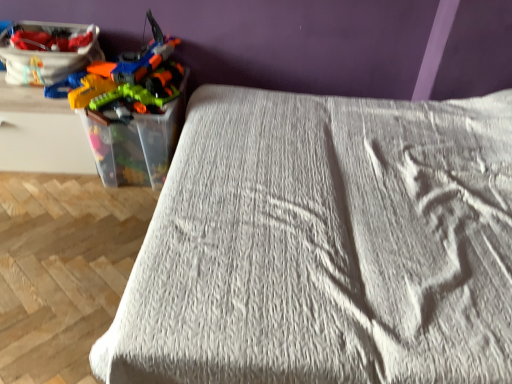
Question: Does white textured bed at center turn towards translucent plastic toy guns at left?

Choices:
 (A) no
 (B) yes

Answer: (B)

Question: From the image's perspective, is white textured bed at center under translucent plastic toy guns at left?

Choices:
 (A) yes
 (B) no

Answer: (A)

Question: Does white textured bed at center have a greater width compared to translucent plastic toy guns at left?

Choices:
 (A) no
 (B) yes

Answer: (B)

Question: Is white textured bed at center to the left of translucent plastic toy guns at left from the viewer's perspective?

Choices:
 (A) no
 (B) yes

Answer: (A)

Question: Is white textured bed at center positioned with its back to translucent plastic toy guns at left?

Choices:
 (A) no
 (B) yes

Answer: (A)

Question: Do you think matte plastic toy box at upper left is within translucent plastic toy guns at left, or outside of it?

Choices:
 (A) inside
 (B) outside

Answer: (A)

Question: From the image's perspective, is matte plastic toy box at upper left located above or below translucent plastic toy guns at left?

Choices:
 (A) below
 (B) above

Answer: (B)

Question: In terms of width, does matte plastic toy box at upper left look wider or thinner when compared to translucent plastic toy guns at left?

Choices:
 (A) thin
 (B) wide

Answer: (A)

Question: Is point (47, 48) closer or farther from the camera than point (179, 99)?

Choices:
 (A) farther
 (B) closer

Answer: (B)

Question: Is translucent plastic toy guns at left wider or thinner than matte plastic toy box at upper left?

Choices:
 (A) thin
 (B) wide

Answer: (B)

Question: In the image, is translucent plastic toy guns at left on the left side or the right side of matte plastic toy box at upper left?

Choices:
 (A) right
 (B) left

Answer: (A)

Question: In the image, is translucent plastic toy guns at left positioned in front of or behind matte plastic toy box at upper left?

Choices:
 (A) behind
 (B) front

Answer: (B)

Question: From the image's perspective, relative to matte plastic toy box at upper left, is translucent plastic toy guns at left above or below?

Choices:
 (A) below
 (B) above

Answer: (A)

Question: Considering the positions of matte plastic toy box at upper left and white textured bed at center in the image, is matte plastic toy box at upper left wider or thinner than white textured bed at center?

Choices:
 (A) thin
 (B) wide

Answer: (A)

Question: In terms of size, does matte plastic toy box at upper left appear bigger or smaller than white textured bed at center?

Choices:
 (A) big
 (B) small

Answer: (B)